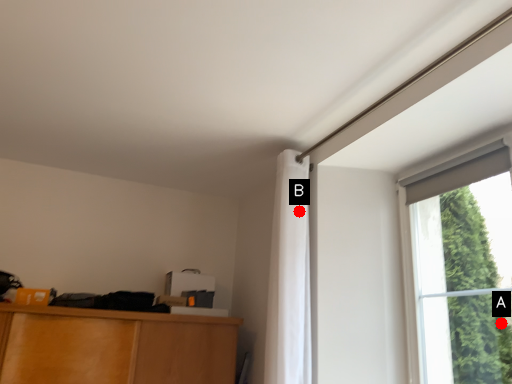
Question: Two points are circled on the image, labeled by A and B beside each circle. Which point appears closest to the camera in this image?

Choices:
 (A) A is closer
 (B) B is closer

Answer: (B)